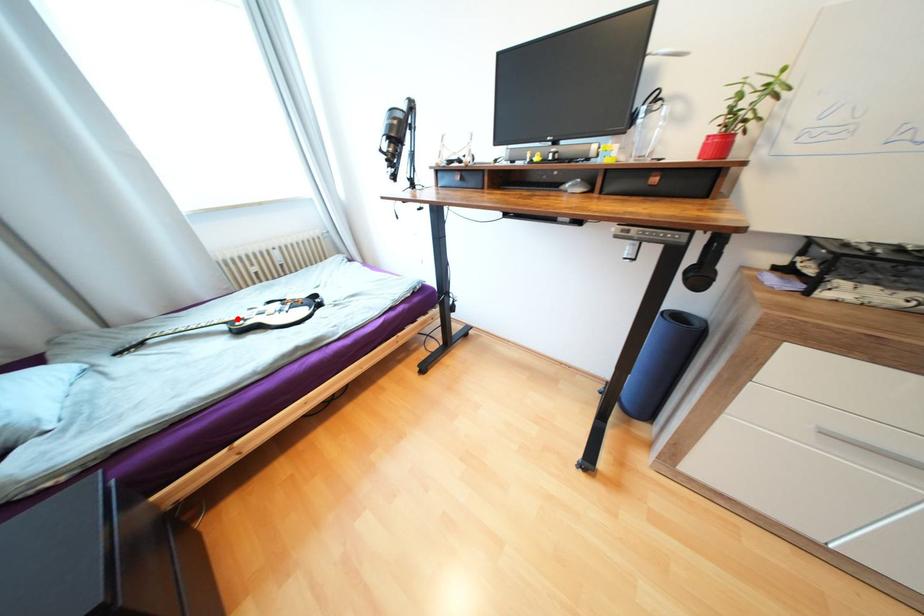
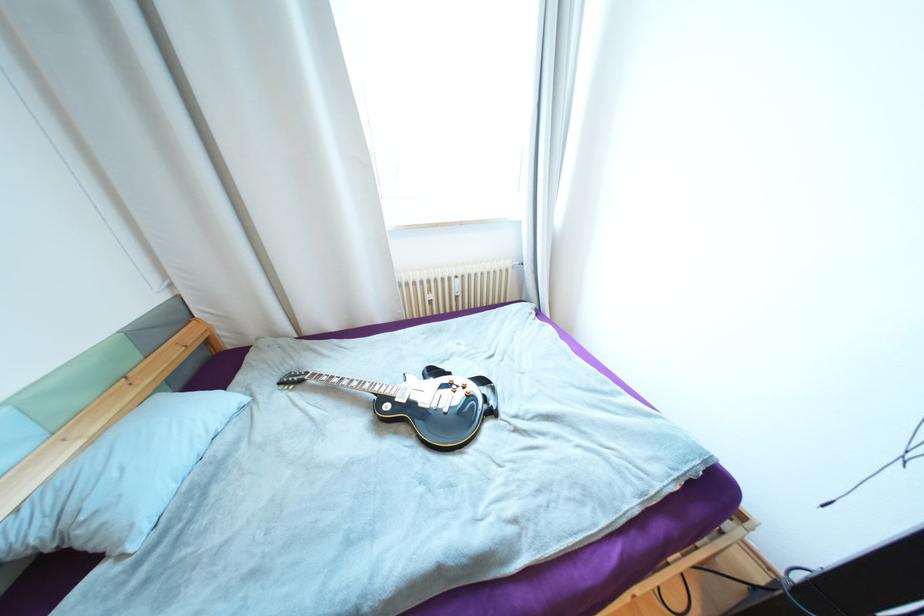
Locate, in the second image, the point that corresponds to the highlighted location in the first image.

(387, 391)